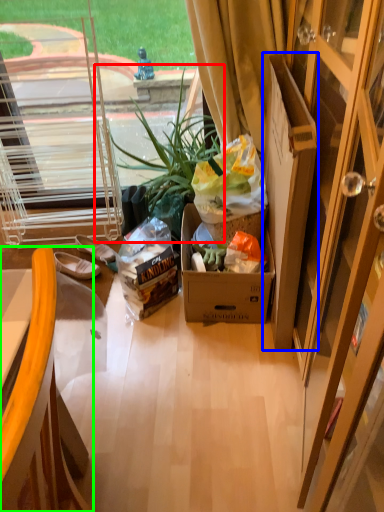
Question: Estimate the real-world distances between objects in this image. Which object is closer to houseplant (highlighted by a red box), cardboard box (highlighted by a blue box) or chair (highlighted by a green box)?

Choices:
 (A) cardboard box
 (B) chair

Answer: (A)